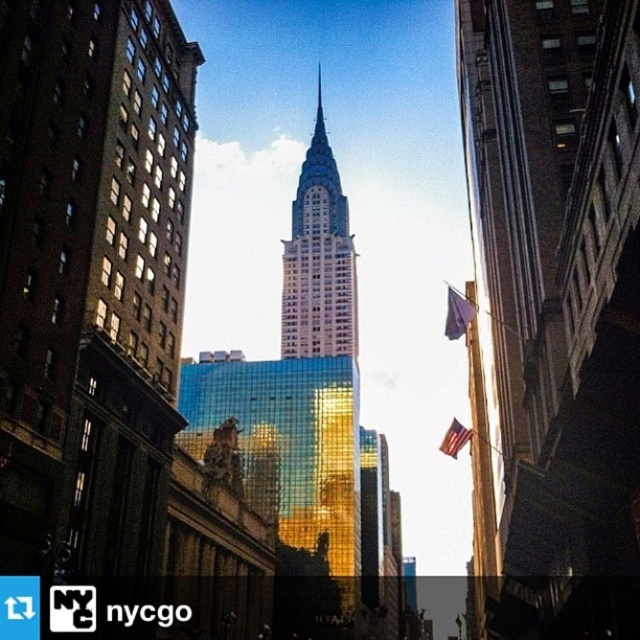
Which is in front, point (288, 269) or point (456, 316)?

Point (456, 316)

Can you confirm if gold reflective glass skyscraper at center is bigger than purple fabric flag at upper right?

Indeed, gold reflective glass skyscraper at center has a larger size compared to purple fabric flag at upper right.

Which is behind, point (282, 339) or point (458, 307)?

Point (282, 339)

This screenshot has width=640, height=640. Find the location of `gold reflective glass skyscraper at center`. gold reflective glass skyscraper at center is located at coordinates (317, 259).

Describe the element at coordinates (317, 259) in the screenshot. The height and width of the screenshot is (640, 640). I see `gold reflective glass skyscraper at center` at that location.

In the scene shown: Between gold reflective glass skyscraper at center and american flag at center, which one appears on the right side from the viewer's perspective?

american flag at center

Is point (316, 225) more distant than point (451, 429)?

Yes, it is behind point (451, 429).

At what (x,y) coordinates should I click in order to perform the action: click on gold reflective glass skyscraper at center. Please return your answer as a coordinate pair (x, y). The width and height of the screenshot is (640, 640). Looking at the image, I should click on (317, 259).

Is purple fabric flag at upper right shorter than american flag at center?

Yes, purple fabric flag at upper right is shorter than american flag at center.

Is purple fabric flag at upper right thinner than american flag at center?

Indeed, purple fabric flag at upper right has a lesser width compared to american flag at center.

From the picture: Who is more forward, (449, 291) or (456, 440)?

Point (456, 440) is more forward.

The height and width of the screenshot is (640, 640). Find the location of `purple fabric flag at upper right`. purple fabric flag at upper right is located at coordinates (458, 314).